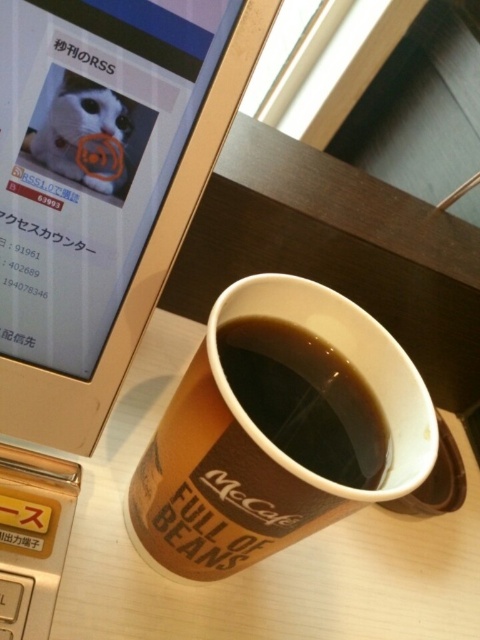
Question: Does brown paper cup at center have a smaller size compared to black paper cup at center?

Choices:
 (A) yes
 (B) no

Answer: (B)

Question: Which point is farther to the camera?

Choices:
 (A) (280, 428)
 (B) (169, 445)

Answer: (B)

Question: Is brown paper cup at center thinner than black paper cup at center?

Choices:
 (A) yes
 (B) no

Answer: (B)

Question: Is brown paper cup at center wider than black paper cup at center?

Choices:
 (A) yes
 (B) no

Answer: (A)

Question: Among these points, which one is farthest from the camera?

Choices:
 (A) (312, 401)
 (B) (248, 461)

Answer: (A)